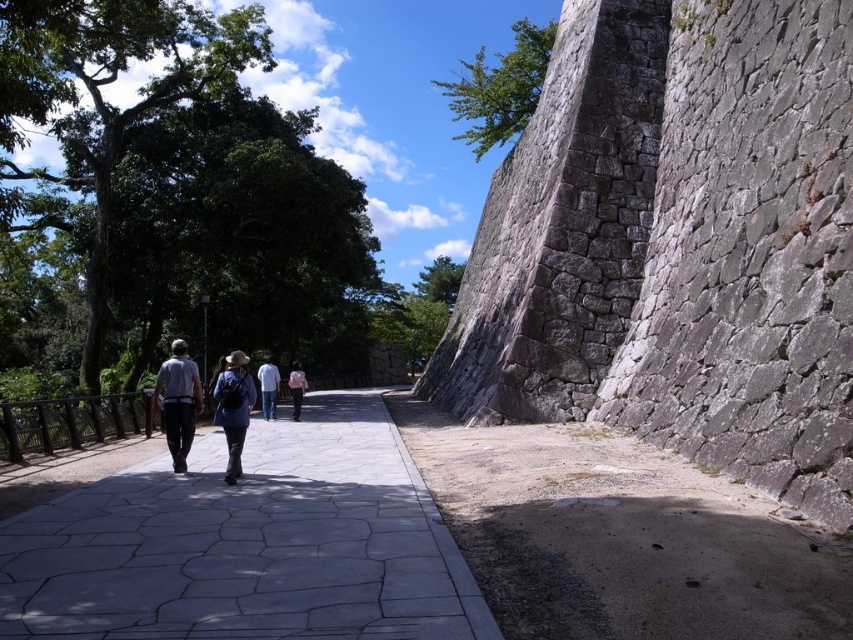
Is point (225, 419) more distant than point (274, 381)?

No, it is in front of (274, 381).

Does blue fabric backpack at center have a greater width compared to white cotton shirt at center?

Indeed, blue fabric backpack at center has a greater width compared to white cotton shirt at center.

What do you see at coordinates (233, 406) in the screenshot? The height and width of the screenshot is (640, 853). I see `blue fabric backpack at center` at bounding box center [233, 406].

Find the location of a particular element. The height and width of the screenshot is (640, 853). blue fabric backpack at center is located at coordinates (233, 406).

Can you confirm if gray stone pavement at center is thinner than pink fabric shirt at center?

Correct, gray stone pavement at center's width is less than pink fabric shirt at center's.

Is gray stone pavement at center bigger than pink fabric shirt at center?

Actually, gray stone pavement at center might be smaller than pink fabric shirt at center.

Is point (281, 433) farther from camera compared to point (299, 387)?

No, it is not.

In order to click on gray stone pavement at center in this screenshot , I will do `click(248, 545)`.

Does light gray cotton shirt at center have a lesser height compared to blue fabric backpack at center?

Incorrect, light gray cotton shirt at center's height does not fall short of blue fabric backpack at center's.

Is point (196, 392) farther from camera compared to point (231, 472)?

That is True.

Is point (195, 406) less distant than point (227, 477)?

No, (195, 406) is behind (227, 477).

Identify the location of light gray cotton shirt at center. Image resolution: width=853 pixels, height=640 pixels. (178, 401).